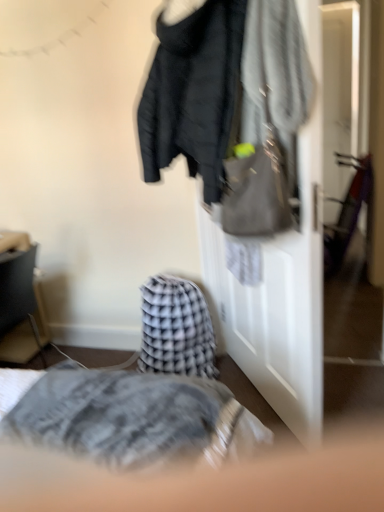
Question: Is matte black jacket at upper center situated inside matte gray handbag at upper right or outside?

Choices:
 (A) outside
 (B) inside

Answer: (A)

Question: From their relative heights in the image, would you say matte black jacket at upper center is taller or shorter than matte gray handbag at upper right?

Choices:
 (A) short
 (B) tall

Answer: (B)

Question: Considering the real-world distances, which object is closest to the matte black jacket at upper center?

Choices:
 (A) matte gray handbag at upper right
 (B) matte black jacket at center
 (C) checkered fabric blanket at center
 (D) matte black side table at left

Answer: (A)

Question: Which object is the closest to the checkered fabric blanket at center?

Choices:
 (A) matte black side table at left
 (B) matte gray handbag at upper right
 (C) matte black jacket at upper center
 (D) matte black jacket at center

Answer: (D)